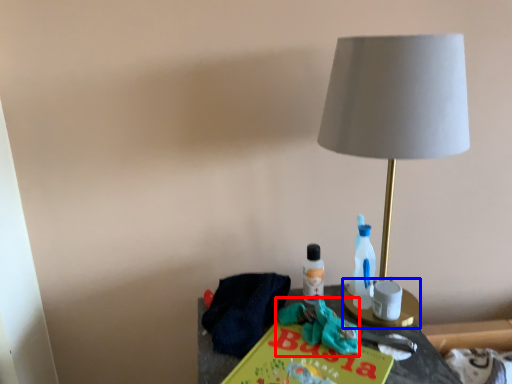
Question: Among these objects, which one is farthest to the camera, scrub (highlighted by a red box) or candle holder (highlighted by a blue box)?

Choices:
 (A) scrub
 (B) candle holder

Answer: (B)